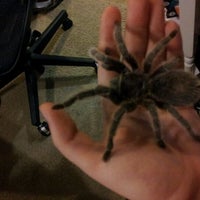
This screenshot has height=200, width=200. What are the coordinates of `carpet` in the screenshot? It's located at click(x=90, y=21).